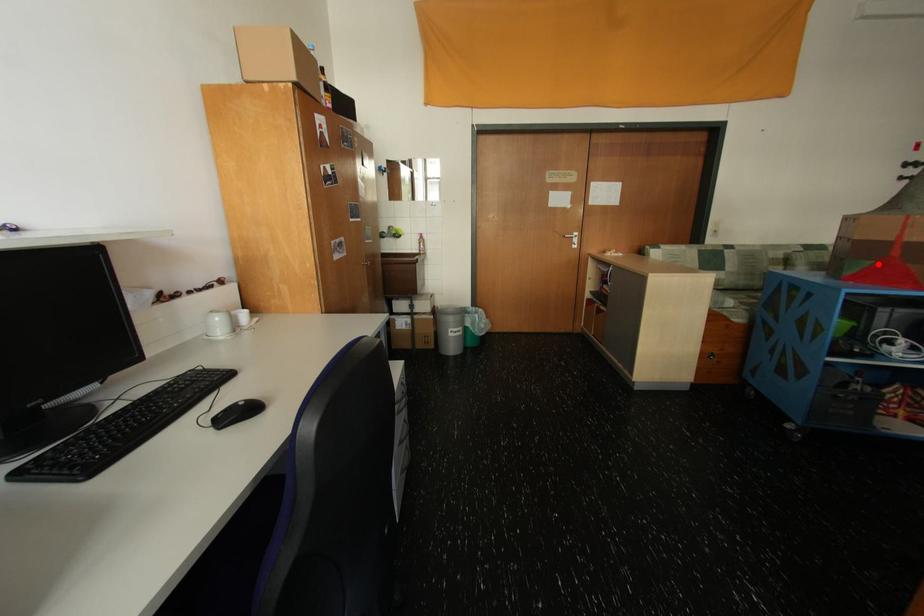
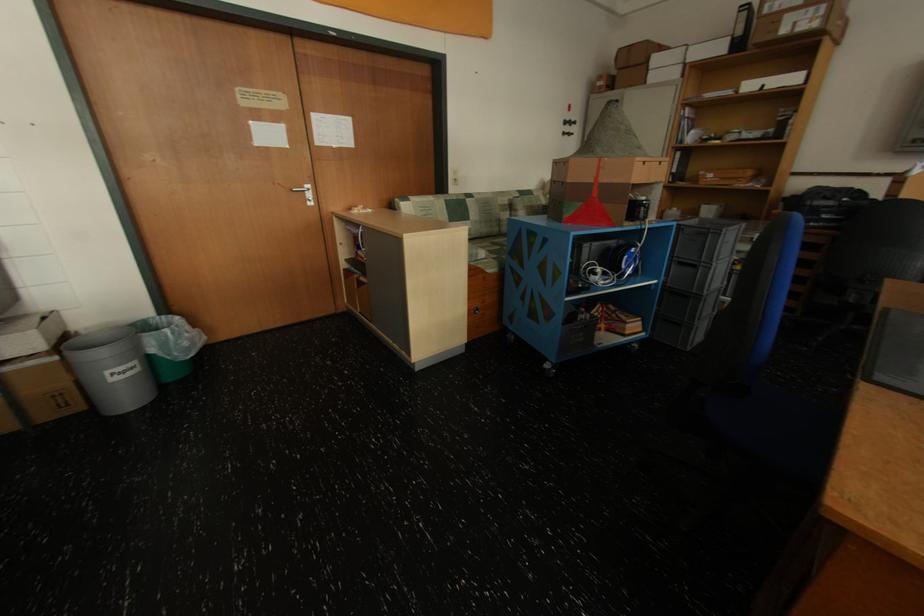
Where in the second image is the point corresponding to the highlighted location from the first image?

(589, 206)